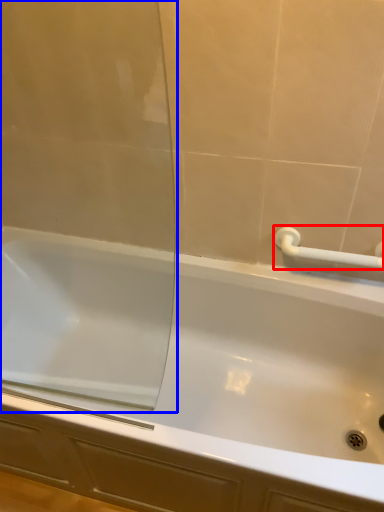
Question: Which object is closer to the camera taking this photo, towel bar (highlighted by a red box) or screen door (highlighted by a blue box)?

Choices:
 (A) towel bar
 (B) screen door

Answer: (B)